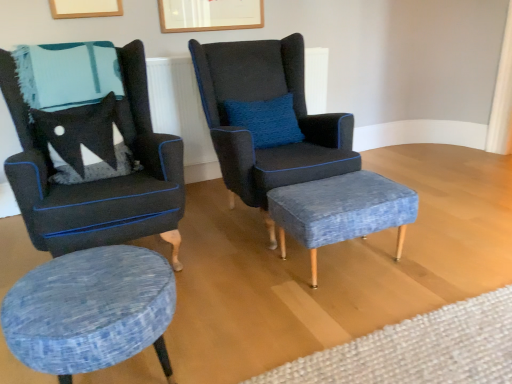
This screenshot has width=512, height=384. What do you see at coordinates (418, 349) in the screenshot?
I see `white textured rug at lower right, marked as the 1th plain in a back-to-front arrangement` at bounding box center [418, 349].

Measure the distance between blue textured ottoman at center, which appears as the 1th plain when viewed from the front, and camera.

The distance of blue textured ottoman at center, which appears as the 1th plain when viewed from the front, from camera is 1.24 meters.

Locate an element on the screen. The width and height of the screenshot is (512, 384). textured blue fabric wingback chair at left, which is the 1th chair in left-to-right order is located at coordinates (99, 180).

The height and width of the screenshot is (384, 512). What do you see at coordinates (268, 99) in the screenshot? I see `velvet dark blue armchair at center, placed as the 1th chair when sorted from right to left` at bounding box center [268, 99].

Where is `white textured rug at lower right, marked as the 1th plain in a back-to-front arrangement`? The width and height of the screenshot is (512, 384). white textured rug at lower right, marked as the 1th plain in a back-to-front arrangement is located at coordinates (418, 349).

Locate an element on the screen. stool that is on the right side of velvet dark blue armchair at center, placed as the 1th chair when sorted from right to left is located at coordinates (341, 211).

Is blue fabric stool at center, which appears as the 2th stool when viewed from the front, shorter than velvet dark blue armchair at center, placed as the 1th chair when sorted from right to left?

Yes.

Could you tell me if blue fabric stool at center, marked as the 2th stool in a left-to-right arrangement, is turned towards velvet dark blue armchair at center, placed as the 1th chair when sorted from right to left?

No, blue fabric stool at center, marked as the 2th stool in a left-to-right arrangement, is not oriented towards velvet dark blue armchair at center, placed as the 1th chair when sorted from right to left.

Which object is wider, white textured rug at lower right, marked as the 1th plain in a back-to-front arrangement, or blue textured ottoman at center, which appears as the 1th plain when viewed from the front?

Wider between the two is blue textured ottoman at center, which appears as the 1th plain when viewed from the front.

From a real-world perspective, is white textured rug at lower right, the 2th plain positioned from the front, beneath blue textured ottoman at center, which appears as the 1th plain when viewed from the front?

No.

Is white textured rug at lower right, marked as the 1th plain in a back-to-front arrangement, facing away from blue textured ottoman at center, which appears as the 1th plain when viewed from the front?

white textured rug at lower right, marked as the 1th plain in a back-to-front arrangement, is not turned away from blue textured ottoman at center, which appears as the 1th plain when viewed from the front.

Are white textured rug at lower right, the 2th plain positioned from the front, and blue textured ottoman at center, the second plain from the back, making contact?

white textured rug at lower right, the 2th plain positioned from the front, and blue textured ottoman at center, the second plain from the back, are clearly separated.

Are velvet dark blue armchair at center, placed as the 1th chair when sorted from right to left, and textured blue fabric stool at lower left, positioned as the first stool in left-to-right order, far apart?

Indeed, velvet dark blue armchair at center, placed as the 1th chair when sorted from right to left, is not near textured blue fabric stool at lower left, positioned as the first stool in left-to-right order.

Could you tell me if velvet dark blue armchair at center, placed as the 1th chair when sorted from right to left, is turned towards textured blue fabric stool at lower left, positioned as the first stool in left-to-right order?

No, velvet dark blue armchair at center, placed as the 1th chair when sorted from right to left, is not facing towards textured blue fabric stool at lower left, positioned as the first stool in left-to-right order.

In the scene shown: Between velvet dark blue armchair at center, the 2th chair when ordered from left to right, and textured blue fabric stool at lower left, positioned as the first stool in left-to-right order, which one has larger size?

With larger size is velvet dark blue armchair at center, the 2th chair when ordered from left to right.

The image size is (512, 384). I want to click on the 1st chair above the textured blue fabric stool at lower left, positioned as the first stool in left-to-right order (from a real-world perspective), so click(x=268, y=99).

Is point (136, 122) positioned behind point (464, 379)?

That is True.

Considering the relative sizes of textured blue fabric wingback chair at left, which is the 1th chair in left-to-right order, and white textured rug at lower right, marked as the 1th plain in a back-to-front arrangement, in the image provided, is textured blue fabric wingback chair at left, which is the 1th chair in left-to-right order, smaller than white textured rug at lower right, marked as the 1th plain in a back-to-front arrangement,?

Incorrect, textured blue fabric wingback chair at left, which is the 1th chair in left-to-right order, is not smaller in size than white textured rug at lower right, marked as the 1th plain in a back-to-front arrangement.

From a real-world perspective, is textured blue fabric wingback chair at left, acting as the second chair starting from the right, physically located above or below white textured rug at lower right, marked as the 1th plain in a back-to-front arrangement?

Clearly, from a real-world perspective, textured blue fabric wingback chair at left, acting as the second chair starting from the right, is above white textured rug at lower right, marked as the 1th plain in a back-to-front arrangement.

From the image's perspective, relative to white textured rug at lower right, the 2th plain positioned from the front, is textured blue fabric wingback chair at left, acting as the second chair starting from the right, above or below?

From the image's perspective, textured blue fabric wingback chair at left, acting as the second chair starting from the right, appears above white textured rug at lower right, the 2th plain positioned from the front.

Considering the positions of points (139, 337) and (244, 324), is point (139, 337) farther from camera compared to point (244, 324)?

No, it is in front of (244, 324).

In the image, is textured blue fabric stool at lower left, placed as the 1th stool when sorted from front to back, on the left side or the right side of blue textured ottoman at center, which appears as the 1th plain when viewed from the front?

From the image, it's evident that textured blue fabric stool at lower left, placed as the 1th stool when sorted from front to back, is to the left of blue textured ottoman at center, which appears as the 1th plain when viewed from the front.

From a real-world perspective, relative to blue textured ottoman at center, which appears as the 1th plain when viewed from the front, is textured blue fabric stool at lower left, the second stool viewed from the right, vertically above or below?

In terms of real-world spatial position, textured blue fabric stool at lower left, the second stool viewed from the right, is above blue textured ottoman at center, which appears as the 1th plain when viewed from the front.

Can you confirm if velvet dark blue armchair at center, placed as the 1th chair when sorted from right to left, is smaller than white textured rug at lower right, marked as the 1th plain in a back-to-front arrangement?

Incorrect, velvet dark blue armchair at center, placed as the 1th chair when sorted from right to left, is not smaller in size than white textured rug at lower right, marked as the 1th plain in a back-to-front arrangement.

From the image's perspective, would you say velvet dark blue armchair at center, the 2th chair when ordered from left to right, is positioned over white textured rug at lower right, marked as the 1th plain in a back-to-front arrangement?

Indeed, from the image's perspective, velvet dark blue armchair at center, the 2th chair when ordered from left to right, is shown above white textured rug at lower right, marked as the 1th plain in a back-to-front arrangement.

From a real-world perspective, is velvet dark blue armchair at center, placed as the 1th chair when sorted from right to left, above or below white textured rug at lower right, the 2th plain positioned from the front?

Clearly, from a real-world perspective, velvet dark blue armchair at center, placed as the 1th chair when sorted from right to left, is above white textured rug at lower right, the 2th plain positioned from the front.

Which is behind, point (255, 179) or point (459, 314)?

The point (255, 179) is farther from the camera.

Which is more to the right, blue fabric stool at center, marked as the 2th stool in a left-to-right arrangement, or blue textured ottoman at center, the second plain from the back?

Positioned to the right is blue textured ottoman at center, the second plain from the back.

From a real-world perspective, which object rests below the other?

blue textured ottoman at center, which appears as the 1th plain when viewed from the front, is physically lower.

From a real-world perspective, starting from the blue fabric stool at center, the 1th stool viewed from the back, which plain is the 2nd one below it? Please provide its 2D coordinates.

[(336, 267)]

Which is in front, point (301, 238) or point (28, 270)?

Point (301, 238)

What are the coordinates of `the 1st stool below when counting from the velvet dark blue armchair at center, the 2th chair when ordered from left to right (from the image's perspective)` in the screenshot? It's located at (341, 211).

The height and width of the screenshot is (384, 512). Find the location of `plain that is under the white textured rug at lower right, marked as the 1th plain in a back-to-front arrangement (from a real-world perspective)`. plain that is under the white textured rug at lower right, marked as the 1th plain in a back-to-front arrangement (from a real-world perspective) is located at coordinates (336, 267).

When comparing their distances from white textured rug at lower right, marked as the 1th plain in a back-to-front arrangement, does blue fabric stool at center, which appears as the 1th stool when viewed from the right, or textured blue fabric stool at lower left, placed as the 1th stool when sorted from front to back, seem closer?

blue fabric stool at center, which appears as the 1th stool when viewed from the right, is closer to white textured rug at lower right, marked as the 1th plain in a back-to-front arrangement.

Looking at the image, which one is located further to blue textured ottoman at center, which appears as the 1th plain when viewed from the front, textured blue fabric stool at lower left, positioned as the first stool in left-to-right order, or textured blue fabric wingback chair at left, which is the 1th chair in left-to-right order?

Based on the image, textured blue fabric wingback chair at left, which is the 1th chair in left-to-right order, appears to be further to blue textured ottoman at center, which appears as the 1th plain when viewed from the front.

When comparing their distances from blue fabric stool at center, which appears as the 2th stool when viewed from the front, does textured blue fabric stool at lower left, placed as the 1th stool when sorted from front to back, or velvet dark blue armchair at center, placed as the 1th chair when sorted from right to left, seem further?

Among the two, textured blue fabric stool at lower left, placed as the 1th stool when sorted from front to back, is located further to blue fabric stool at center, which appears as the 2th stool when viewed from the front.

Estimate the real-world distances between objects in this image. Which object is further from blue textured ottoman at center, which appears as the 1th plain when viewed from the front, blue fabric stool at center, marked as the 2th stool in a left-to-right arrangement, or textured blue fabric wingback chair at left, acting as the second chair starting from the right?

textured blue fabric wingback chair at left, acting as the second chair starting from the right.

Estimate the real-world distances between objects in this image. Which object is closer to blue fabric stool at center, which appears as the 1th stool when viewed from the right, blue textured ottoman at center, the second plain from the back, or velvet dark blue armchair at center, the 2th chair when ordered from left to right?

The object closer to blue fabric stool at center, which appears as the 1th stool when viewed from the right, is blue textured ottoman at center, the second plain from the back.

Based on their spatial positions, is velvet dark blue armchair at center, the 2th chair when ordered from left to right, or blue textured ottoman at center, which appears as the 1th plain when viewed from the front, closer to blue fabric stool at center, marked as the 2th stool in a left-to-right arrangement?

blue textured ottoman at center, which appears as the 1th plain when viewed from the front, lies closer to blue fabric stool at center, marked as the 2th stool in a left-to-right arrangement, than the other object.

Which object lies further to the anchor point textured blue fabric stool at lower left, arranged as the 2th stool when viewed from the back, blue textured ottoman at center, which appears as the 1th plain when viewed from the front, or textured blue fabric wingback chair at left, which is the 1th chair in left-to-right order?

Among the two, textured blue fabric wingback chair at left, which is the 1th chair in left-to-right order, is located further to textured blue fabric stool at lower left, arranged as the 2th stool when viewed from the back.

Which object lies nearer to the anchor point blue fabric stool at center, marked as the 2th stool in a left-to-right arrangement, velvet dark blue armchair at center, placed as the 1th chair when sorted from right to left, or textured blue fabric stool at lower left, positioned as the first stool in left-to-right order?

velvet dark blue armchair at center, placed as the 1th chair when sorted from right to left.

What are the coordinates of `chair located between textured blue fabric stool at lower left, the second stool viewed from the right, and white textured rug at lower right, marked as the 1th plain in a back-to-front arrangement, in the left-right direction` in the screenshot? It's located at (268, 99).

This screenshot has width=512, height=384. What are the coordinates of `plain between blue textured ottoman at center, which appears as the 1th plain when viewed from the front, and blue fabric stool at center, the 1th stool viewed from the back, along the z-axis` in the screenshot? It's located at (418, 349).

The width and height of the screenshot is (512, 384). Find the location of `chair between textured blue fabric wingback chair at left, which is the 1th chair in left-to-right order, and blue textured ottoman at center, the second plain from the back`. chair between textured blue fabric wingback chair at left, which is the 1th chair in left-to-right order, and blue textured ottoman at center, the second plain from the back is located at coordinates (268, 99).

Identify the location of stool between textured blue fabric stool at lower left, the second stool viewed from the right, and blue textured ottoman at center, which appears as the 1th plain when viewed from the front, from left to right. (341, 211).